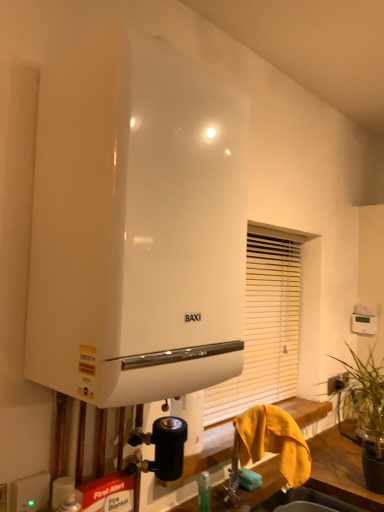
Question: Is white matte soap at lower center in front of or behind green leafy plant at right in the image?

Choices:
 (A) front
 (B) behind

Answer: (B)

Question: From a real-world perspective, is white matte soap at lower center positioned above or below green leafy plant at right?

Choices:
 (A) above
 (B) below

Answer: (B)

Question: Which object is positioned closest to the white matte shutter at center?

Choices:
 (A) white glossy sink at lower center
 (B) white glossy water heater at center
 (C) green leafy plant at right
 (D) white plastic electric outlet at lower left
 (E) white matte soap at lower center

Answer: (C)

Question: Considering the real-world distances, which object is farthest from the green leafy plant at right?

Choices:
 (A) white glossy sink at lower center
 (B) white glossy water heater at center
 (C) white matte soap at lower center
 (D) yellow fabric towel at lower right
 (E) white matte shutter at center

Answer: (B)